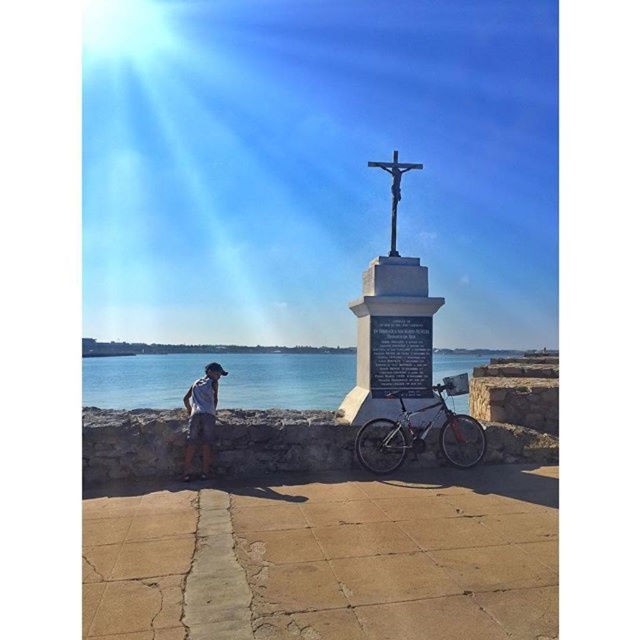
Question: Among these objects, which one is farthest from the camera?

Choices:
 (A) polished stone cross at center
 (B) silver metallic bicycle at center
 (C) black polished stone plaque at center

Answer: (C)

Question: Is silver metallic bicycle at center to the right of wooden cross at center from the viewer's perspective?

Choices:
 (A) no
 (B) yes

Answer: (B)

Question: Is polished stone cross at center positioned behind light brown shorts at lower left?

Choices:
 (A) no
 (B) yes

Answer: (B)

Question: Among these points, which one is farthest from the camera?

Choices:
 (A) (369, 403)
 (B) (392, 195)
 (C) (211, 435)
 (D) (278, 403)

Answer: (D)

Question: Does blue water at lower left appear over light brown shorts at lower left?

Choices:
 (A) no
 (B) yes

Answer: (A)

Question: Among these points, which one is farthest from the camera?

Choices:
 (A) (403, 164)
 (B) (205, 387)
 (C) (442, 390)
 (D) (337, 355)

Answer: (D)